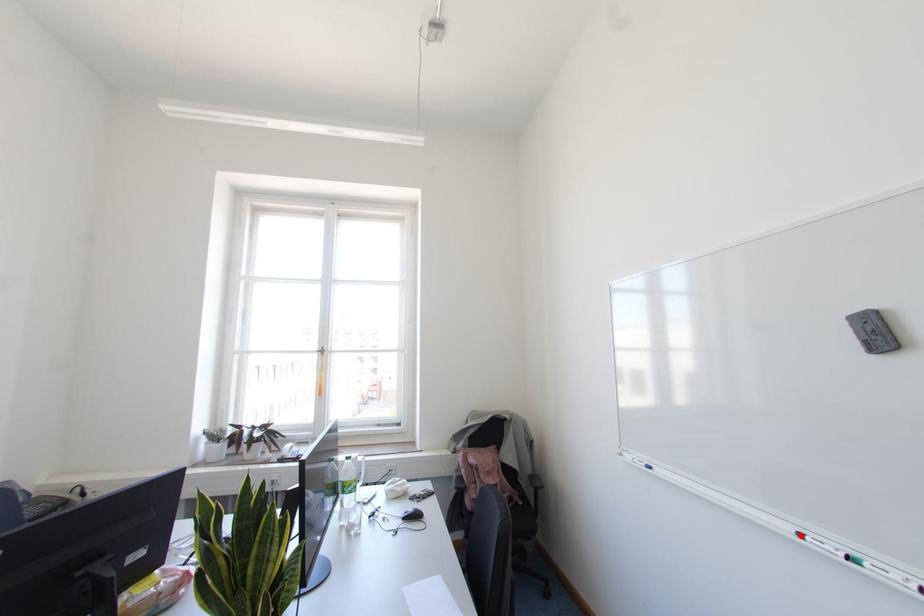
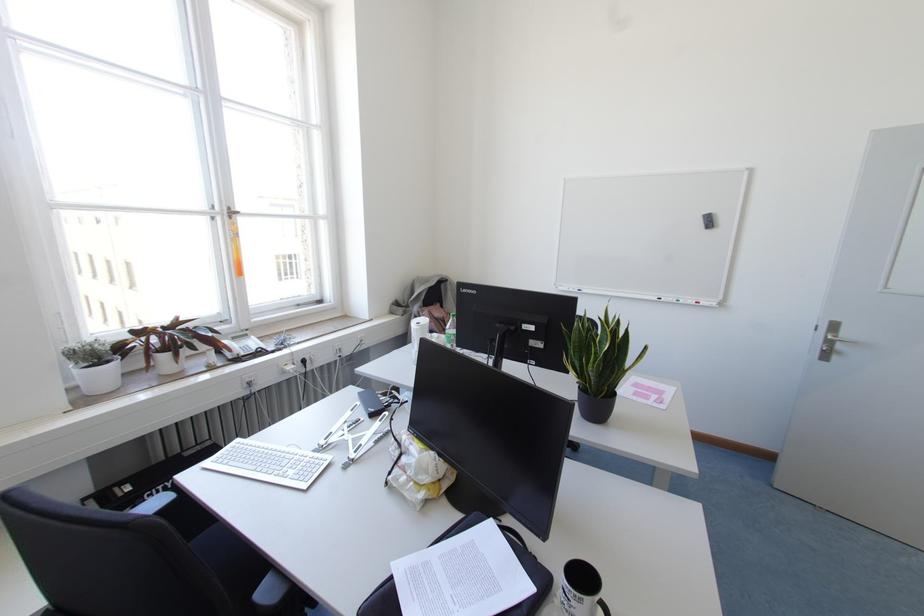
In the second image, find the point that corresponds to the highlighted location in the first image.

(659, 299)